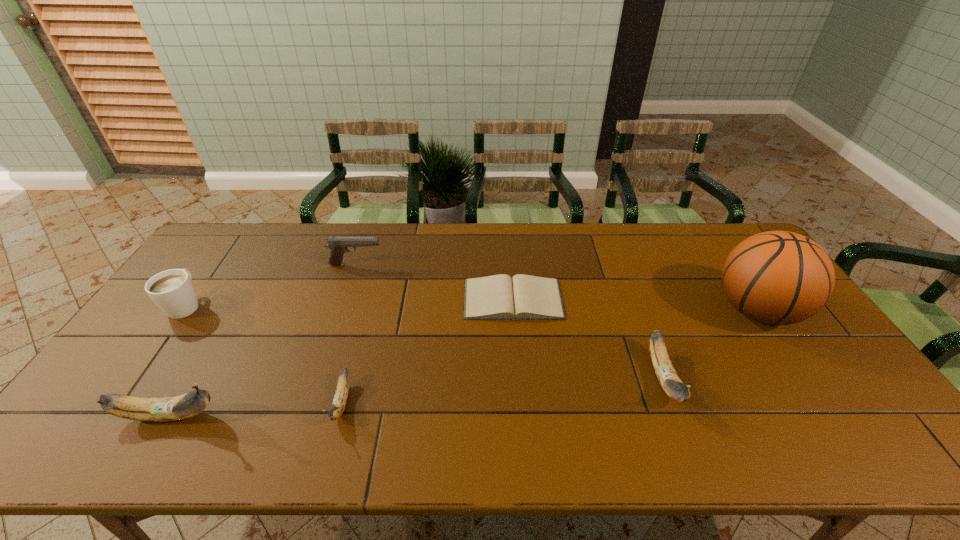
Identify the location of the leftmost banana. (160, 409).

The width and height of the screenshot is (960, 540). Find the location of `the second banana from right to left`. the second banana from right to left is located at coordinates (340, 398).

In order to click on the second shortest object in this screenshot , I will do `click(340, 398)`.

In order to click on the rightmost banana in this screenshot , I will do click(x=671, y=383).

What are the coordinates of `the sixth object from left to right` in the screenshot? It's located at (671, 383).

The image size is (960, 540). I want to click on pistol, so click(338, 245).

Find the location of a particular element. The height and width of the screenshot is (540, 960). cappuccino is located at coordinates (172, 291).

This screenshot has height=540, width=960. In order to click on the tallest object in this screenshot , I will do `click(776, 277)`.

Where is `basketball`? Image resolution: width=960 pixels, height=540 pixels. basketball is located at coordinates (776, 277).

Identify the location of the fifth object from left to right. The width and height of the screenshot is (960, 540). (496, 297).